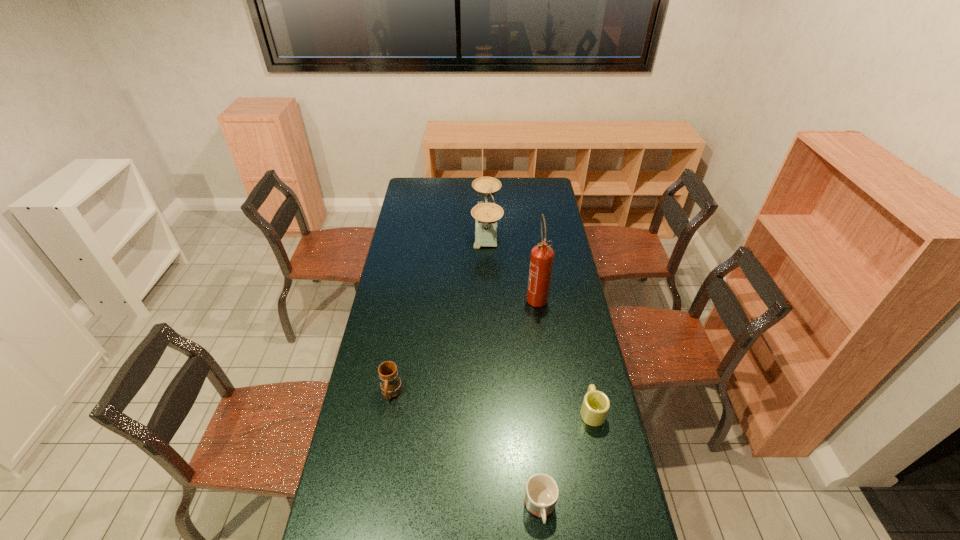
Locate an element on the screen. empty location between the scale and the second farthest object is located at coordinates (x=512, y=262).

Where is `vacant space that's between the leftmost mug and the fire extinguisher`? This screenshot has width=960, height=540. vacant space that's between the leftmost mug and the fire extinguisher is located at coordinates (464, 345).

Locate an element on the screen. This screenshot has width=960, height=540. free spot between the tallest object and the nearest object is located at coordinates (539, 402).

Image resolution: width=960 pixels, height=540 pixels. In order to click on free spot between the rightmost mug and the nearest object in this screenshot , I will do `click(566, 460)`.

Locate an element on the screen. the second closest object to the farthest object is located at coordinates (391, 386).

The width and height of the screenshot is (960, 540). Identify the location of object that is the fourth closest one to the fourth shortest object. 541,494.

Find the location of a particular element. The image size is (960, 540). mug that can be found as the third closest to the farthest object is located at coordinates (541, 494).

I want to click on mug that is the third nearest to the second farthest object, so click(x=541, y=494).

Where is `free space that satisfies the following two spatial constraints: 1. on the front-facing side of the second object from left to right; 2. with the handle on the side of the rightmost object`? The image size is (960, 540). free space that satisfies the following two spatial constraints: 1. on the front-facing side of the second object from left to right; 2. with the handle on the side of the rightmost object is located at coordinates (490, 410).

The width and height of the screenshot is (960, 540). Identify the location of free region that satisfies the following two spatial constraints: 1. on the front-facing side of the scale; 2. with the handle on the side of the rightmost object. (490, 410).